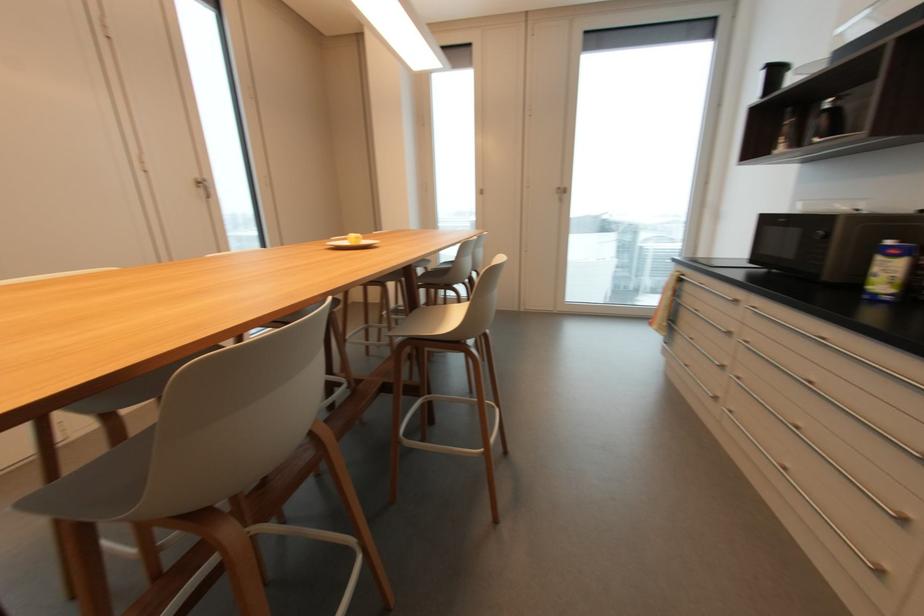
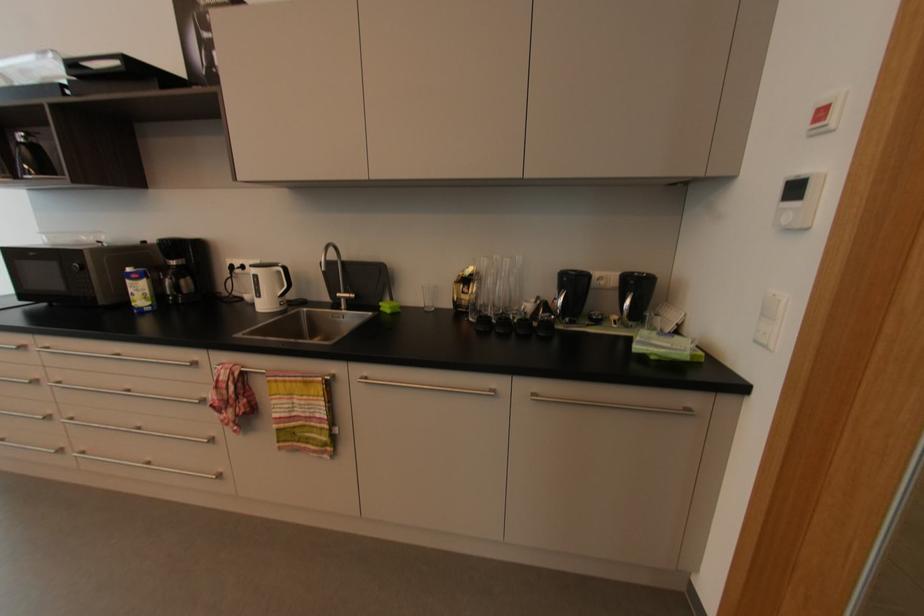
Find the pixel in the second image that matches pixel 895 243 in the first image.

(131, 270)